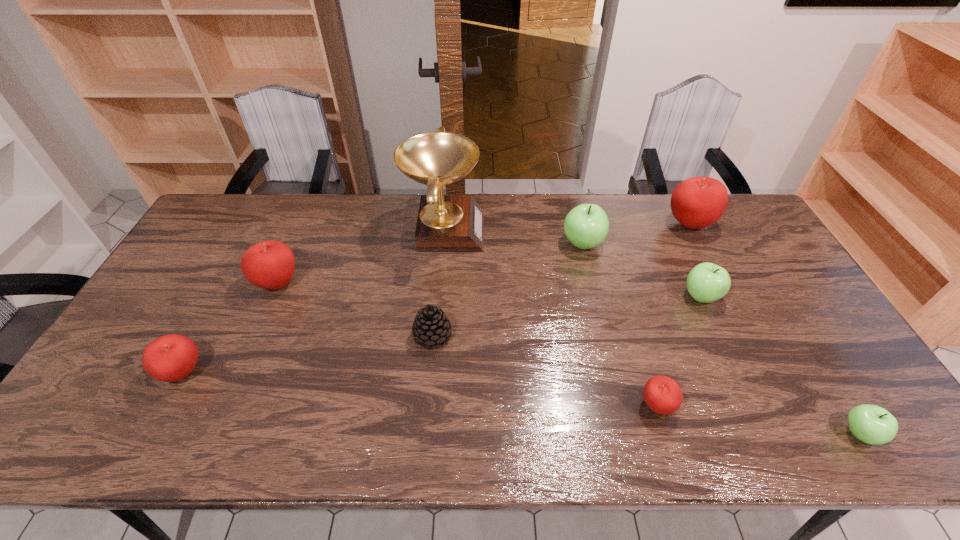
The width and height of the screenshot is (960, 540). Find the location of `green apple that is the second nearest to the fourth nearest object`. green apple that is the second nearest to the fourth nearest object is located at coordinates (707, 282).

Find the location of a particular element. vacant area that satisfies the following two spatial constraints: 1. at the narrow end of the smallest red apple; 2. on the right side of the pinecone is located at coordinates 426,406.

At what (x,y) coordinates should I click in order to perform the action: click on vacant space that satisfies the following two spatial constraints: 1. at the narrow end of the smallest red apple; 2. on the right side of the sixth farthest object. Please return your answer as a coordinate pair (x, y). This screenshot has width=960, height=540. Looking at the image, I should click on (426, 406).

At what (x,y) coordinates should I click in order to perform the action: click on vacant space that satisfies the following two spatial constraints: 1. on the front-facing side of the award; 2. on the front side of the leftmost red apple. Please return your answer as a coordinate pair (x, y). The height and width of the screenshot is (540, 960). Looking at the image, I should click on (432, 373).

Identify the location of vacant space that satisfies the following two spatial constraints: 1. on the front-facing side of the award; 2. on the front side of the leftmost apple. 432,373.

I want to click on blank area in the image that satisfies the following two spatial constraints: 1. on the front side of the farthest green apple; 2. at the narrow end of the pinecone, so click(x=605, y=336).

Where is `free space that satisfies the following two spatial constraints: 1. at the narrow end of the pinecone; 2. on the front side of the third biggest red apple`? The image size is (960, 540). free space that satisfies the following two spatial constraints: 1. at the narrow end of the pinecone; 2. on the front side of the third biggest red apple is located at coordinates (429, 373).